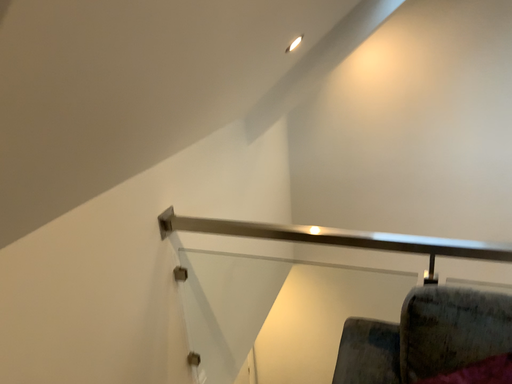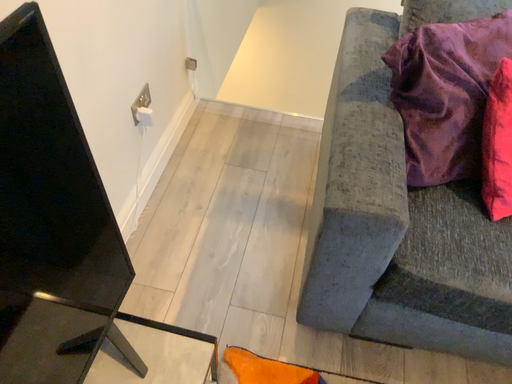
Question: Which way did the camera rotate in the video?

Choices:
 (A) rotated left
 (B) rotated right

Answer: (B)